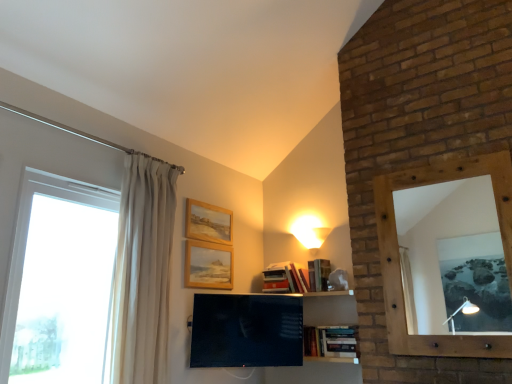
Locate an element on the screen. The height and width of the screenshot is (384, 512). empty space that is ontop of wooden-framed mirror at right (from a real-world perspective) is located at coordinates (435, 166).